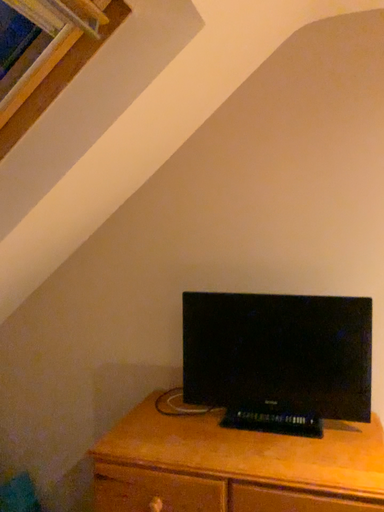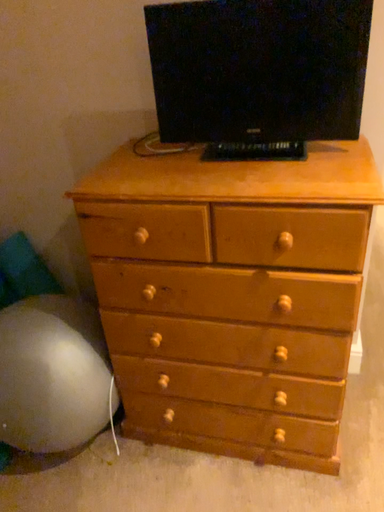
Question: Which way did the camera rotate in the video?

Choices:
 (A) rotated upward
 (B) rotated downward

Answer: (B)